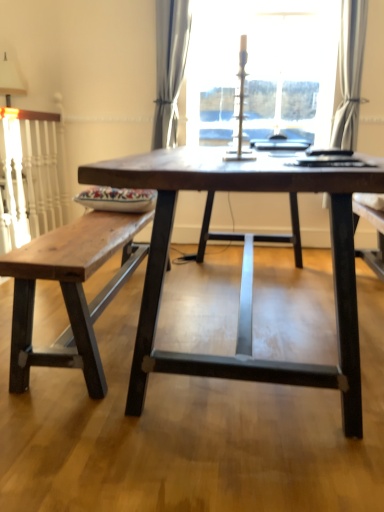
Question: Is rustic wood bench at left to the left or to the right of transparent glass candlestick at upper center in the image?

Choices:
 (A) left
 (B) right

Answer: (A)

Question: From a real-world perspective, is rustic wood bench at left physically located above or below transparent glass candlestick at upper center?

Choices:
 (A) above
 (B) below

Answer: (B)

Question: Which of these objects is positioned farthest from the satin gray curtain at center, acting as the 1th curtain starting from the left?

Choices:
 (A) white sheer curtain at upper right, which appears as the 1th curtain when viewed from the right
 (B) rustic wood bench at left
 (C) dark wood table at center
 (D) transparent glass candlestick at upper center
 (E) white fabric lampshade at upper left

Answer: (C)

Question: Which is farther from the white fabric lampshade at upper left?

Choices:
 (A) satin gray curtain at center, the 2th curtain when ordered from right to left
 (B) rustic wood bench at left
 (C) dark wood table at center
 (D) transparent glass candlestick at upper center
 (E) white sheer curtain at upper right, which is the second curtain from left to right

Answer: (C)